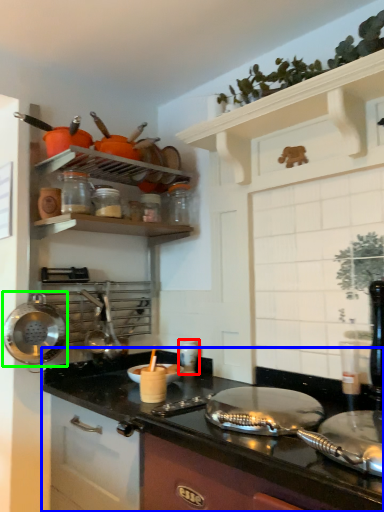
Question: Considering the real-world distances, which object is closest to appliance (highlighted by a red box)? countertop (highlighted by a blue box) or wok (highlighted by a green box).

Choices:
 (A) countertop
 (B) wok

Answer: (A)